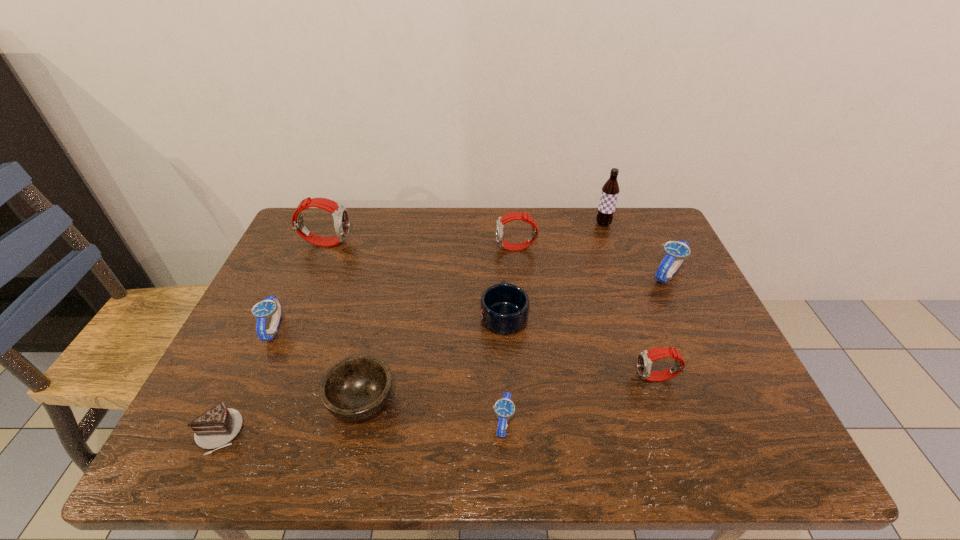
Find the location of `the second biggest blue watch`. the second biggest blue watch is located at coordinates (270, 306).

Identify the location of the second nearest blue watch. (270, 306).

This screenshot has width=960, height=540. Identify the location of blue mug. (504, 308).

Where is `the seventh object from right to left`? This screenshot has height=540, width=960. the seventh object from right to left is located at coordinates (356, 387).

Locate an element on the screen. Image resolution: width=960 pixels, height=540 pixels. brown bowl is located at coordinates (356, 387).

You are a GUI agent. You are given a task and a screenshot of the screen. Output one action in this format:
    pyautogui.click(x=<x>, y=<y>)
    Task: Click on the nearest blue watch
    The image size is (960, 540).
    Given the screenshot: What is the action you would take?
    pyautogui.click(x=504, y=408)

You are a GUI agent. You are given a task and a screenshot of the screen. Output one action in this format:
    pyautogui.click(x=<x>, y=<y>)
    Task: Click on the nearest watch
    The width and height of the screenshot is (960, 540).
    Given the screenshot: What is the action you would take?
    pyautogui.click(x=504, y=408)

The width and height of the screenshot is (960, 540). I want to click on chocolate cake, so [216, 427].

Where is `vacant space located on the front of the tallest object`? This screenshot has width=960, height=540. vacant space located on the front of the tallest object is located at coordinates coord(617,264).

Locate an element on the screen. This screenshot has height=540, width=960. free space located 0.130m on the face of the leftmost red watch is located at coordinates (394, 242).